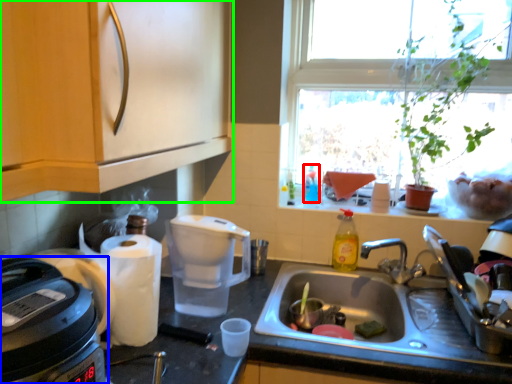
Question: Considering the real-world distances, which object is farthest from bottle (highlighted by a red box)? home appliance (highlighted by a blue box) or cabinetry (highlighted by a green box)?

Choices:
 (A) home appliance
 (B) cabinetry

Answer: (A)